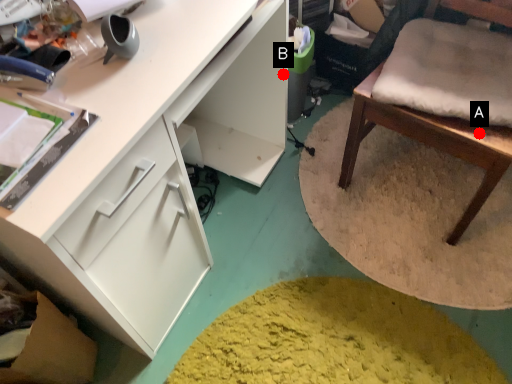
Question: Two points are circled on the image, labeled by A and B beside each circle. Which point is farther from the camera taking this photo?

Choices:
 (A) A is further
 (B) B is further

Answer: (B)